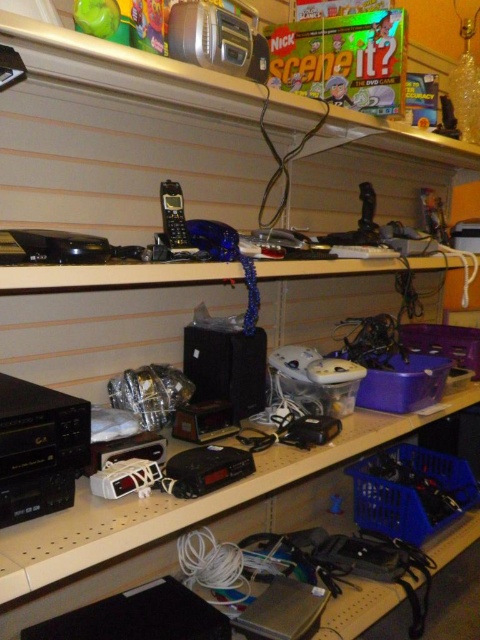
Is black plastic computer desk at center taller than matte black phone at center?

No.

Is point (17, 554) farther from camera compared to point (168, 182)?

That is False.

Identify the location of black plastic computer desk at center. (182, 518).

Is metallic silver alarm clock at center positioned at the back of matte black phone at center?

Yes, metallic silver alarm clock at center is further from the viewer.

Which of these two, metallic silver alarm clock at center or matte black phone at center, stands taller?

With more height is matte black phone at center.

The width and height of the screenshot is (480, 640). Find the location of `metallic silver alarm clock at center`. metallic silver alarm clock at center is located at coordinates (204, 420).

Does metallic silver radio at upper center have a greater width compared to black plastic clock at center?

Indeed, metallic silver radio at upper center has a greater width compared to black plastic clock at center.

Is metallic silver radio at upper center closer to the viewer compared to black plastic clock at center?

No.

Identify the location of metallic silver radio at upper center. (216, 40).

You are a GUI agent. You are given a task and a screenshot of the screen. Output one action in this format:
    pyautogui.click(x=<x>, y=<y>)
    Task: Click on the metallic silver radio at upper center
    This screenshot has width=480, height=640.
    Given the screenshot: What is the action you would take?
    pyautogui.click(x=216, y=40)